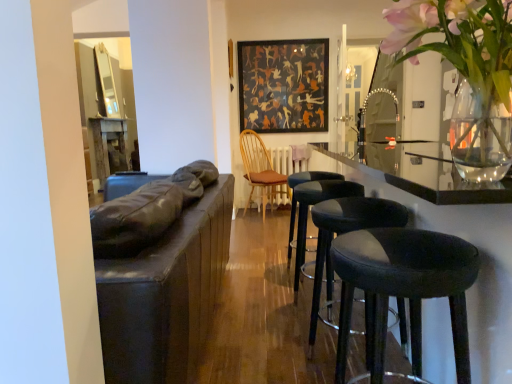
Question: From a real-world perspective, is wooden spindles chair at center located beneath black leather stool at center, which ranks as the third stool in back-to-front order?

Choices:
 (A) no
 (B) yes

Answer: (A)

Question: Does wooden spindles chair at center appear on the right side of black leather stool at center, which ranks as the third stool in back-to-front order?

Choices:
 (A) no
 (B) yes

Answer: (A)

Question: From a real-world perspective, is wooden spindles chair at center on top of black leather stool at center, the second stool when ordered from front to back?

Choices:
 (A) yes
 (B) no

Answer: (A)

Question: Would you say wooden spindles chair at center contains black leather stool at center, which ranks as the third stool in back-to-front order?

Choices:
 (A) no
 (B) yes

Answer: (A)

Question: From the image's perspective, is wooden spindles chair at center on black leather stool at center, which ranks as the third stool in back-to-front order?

Choices:
 (A) no
 (B) yes

Answer: (B)

Question: Would you consider wooden spindles chair at center to be distant from black leather stool at center, the second stool when ordered from front to back?

Choices:
 (A) no
 (B) yes

Answer: (B)

Question: Is black leather stool at lower right, which is counted as the first stool, starting from the front, further to the viewer compared to dark matte painting at center?

Choices:
 (A) yes
 (B) no

Answer: (B)

Question: Can you confirm if black leather stool at lower right, which is counted as the first stool, starting from the front, is positioned to the right of dark matte painting at center?

Choices:
 (A) no
 (B) yes

Answer: (B)

Question: Would you say black leather stool at lower right, which is counted as the first stool, starting from the front, is outside dark matte painting at center?

Choices:
 (A) no
 (B) yes

Answer: (B)

Question: From the image's perspective, is black leather stool at lower right, marked as the 4th stool in a back-to-front arrangement, located beneath dark matte painting at center?

Choices:
 (A) yes
 (B) no

Answer: (A)

Question: Is black leather stool at lower right, which is counted as the first stool, starting from the front, taller than dark matte painting at center?

Choices:
 (A) no
 (B) yes

Answer: (A)

Question: Is black leather stool at lower right, marked as the 4th stool in a back-to-front arrangement, directly adjacent to dark matte painting at center?

Choices:
 (A) yes
 (B) no

Answer: (B)

Question: From the image's perspective, does black leather stool at center, marked as the 2th stool in a back-to-front arrangement, appear lower than wooden spindles chair at center?

Choices:
 (A) no
 (B) yes

Answer: (B)